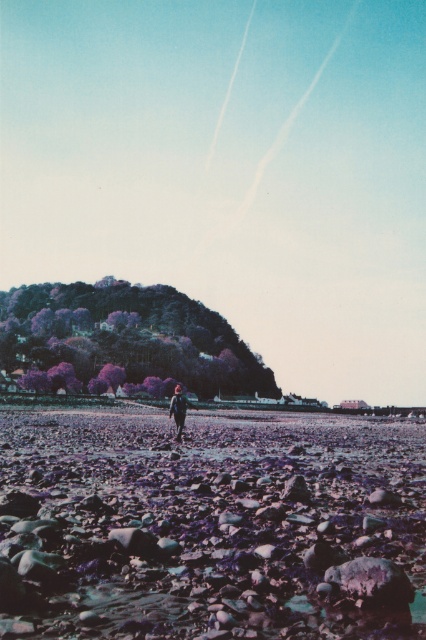
Question: Does purple gravel beach at center appear under dark blue fabric at center?

Choices:
 (A) no
 (B) yes

Answer: (A)

Question: Which point is closer to the camera?

Choices:
 (A) (169, 428)
 (B) (180, 406)

Answer: (B)

Question: Considering the relative positions of purple gravel beach at center and dark blue fabric at center in the image provided, where is purple gravel beach at center located with respect to dark blue fabric at center?

Choices:
 (A) right
 (B) left

Answer: (A)

Question: Does purple gravel beach at center appear on the left side of dark blue fabric at center?

Choices:
 (A) yes
 (B) no

Answer: (B)